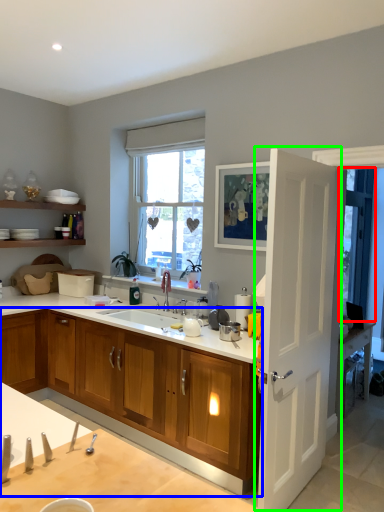
Question: Which object is positioned farthest from window screen (highlighted by a red box)? Select from cabinetry (highlighted by a blue box) and door (highlighted by a green box).

Choices:
 (A) cabinetry
 (B) door

Answer: (A)